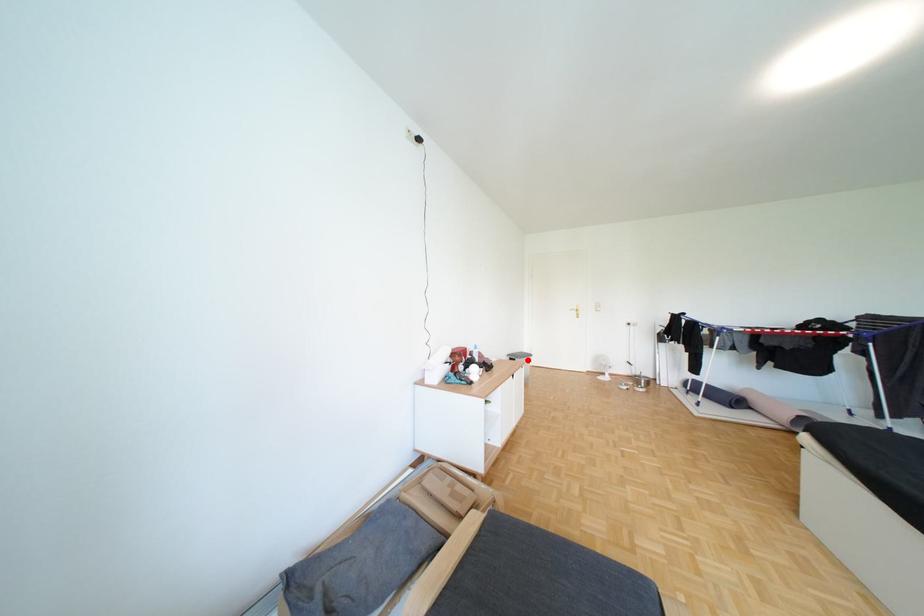
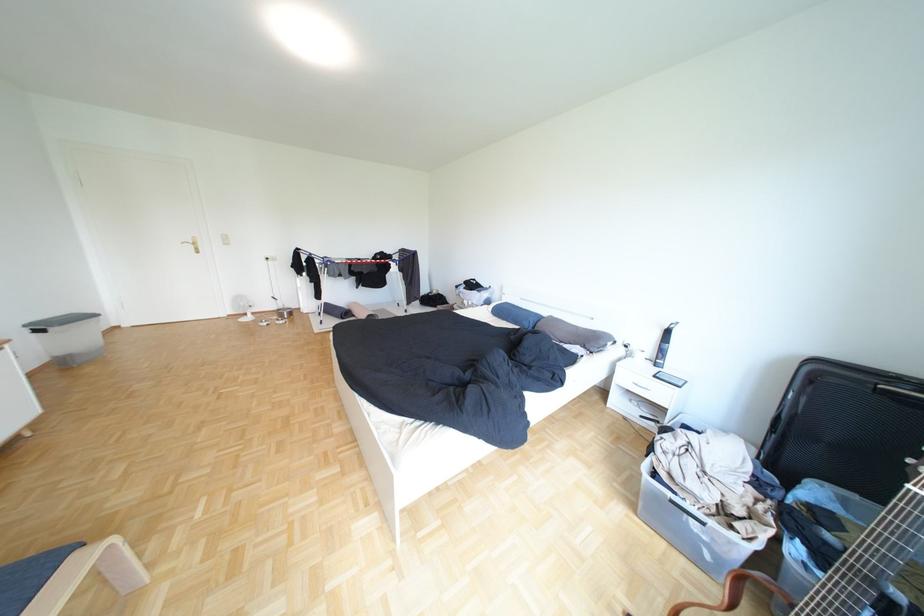
Question: I am providing you with two images of the same scene from different viewpoints. Given a red point in image1, look at the same physical point in image2. Is it:

Choices:
 (A) Closer to the viewpoint
 (B) Farther from the viewpoint

Answer: (B)